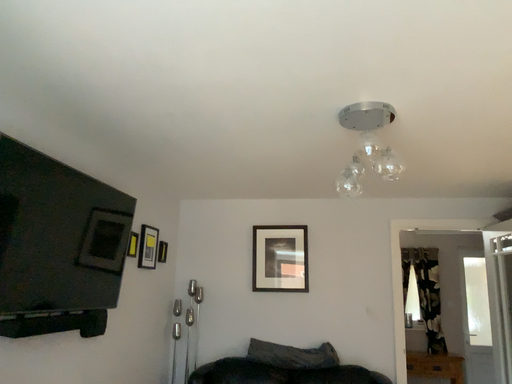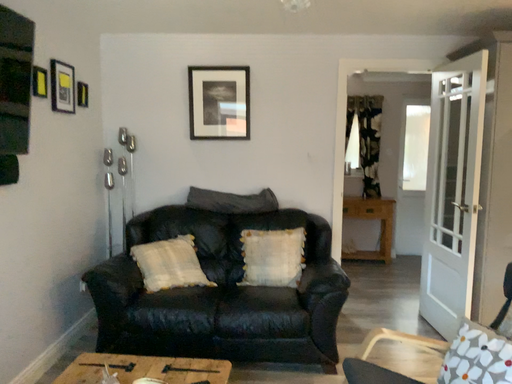
Question: How did the camera likely rotate when shooting the video?

Choices:
 (A) rotated left
 (B) rotated right

Answer: (B)